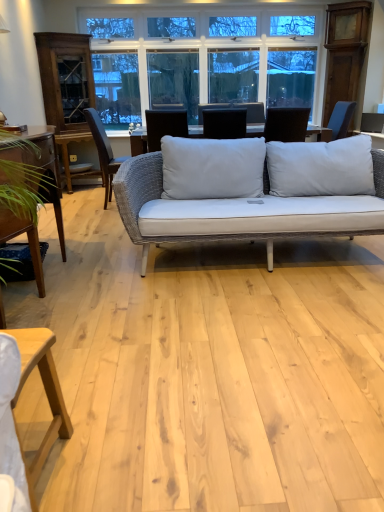
Question: Which direction should I rotate to face matte black laptop at center, which appears as the 1th chair when viewed from the front, — up or down?

Choices:
 (A) up
 (B) down

Answer: (A)

Question: From a real-world perspective, is light wood table at lower left, the first table ordered from the bottom, below matte black laptop at center, which appears as the 1th chair when viewed from the front?

Choices:
 (A) yes
 (B) no

Answer: (A)

Question: Would you say matte black laptop at center, which appears as the 1th chair when viewed from the front, is part of light wood table at lower left, placed as the second table when sorted from back to front,'s contents?

Choices:
 (A) yes
 (B) no

Answer: (B)

Question: Is light wood table at lower left, acting as the second table starting from the left, at the left side of matte black laptop at center, which is counted as the first chair, starting from the right?

Choices:
 (A) yes
 (B) no

Answer: (A)

Question: From a real-world perspective, does light wood table at lower left, which appears as the second table when viewed from the top, stand above matte black laptop at center, which appears as the 1th chair when viewed from the front?

Choices:
 (A) no
 (B) yes

Answer: (A)

Question: Is light wood table at lower left, which is the 1th table in front-to-back order, outside matte black laptop at center, which is counted as the first chair, starting from the right?

Choices:
 (A) no
 (B) yes

Answer: (B)

Question: Is light wood table at lower left, the first table ordered from the bottom, positioned with its back to matte black laptop at center, which is counted as the first chair, starting from the right?

Choices:
 (A) yes
 (B) no

Answer: (B)

Question: Is white glass window at upper center wider than light wood table at lower left, acting as the second table starting from the left?

Choices:
 (A) no
 (B) yes

Answer: (A)

Question: Is white glass window at upper center aimed at light wood table at lower left, placed as the second table when sorted from back to front?

Choices:
 (A) no
 (B) yes

Answer: (B)

Question: Does white glass window at upper center appear on the left side of light wood table at lower left, acting as the second table starting from the left?

Choices:
 (A) yes
 (B) no

Answer: (B)

Question: Is light wood table at lower left, which appears as the second table when viewed from the top, located within white glass window at upper center?

Choices:
 (A) yes
 (B) no

Answer: (B)

Question: From the image's perspective, is white glass window at upper center above light wood table at lower left, placed as the second table when sorted from back to front?

Choices:
 (A) yes
 (B) no

Answer: (A)

Question: From a real-world perspective, is white glass window at upper center positioned under light wood table at lower left, positioned as the 1th table in right-to-left order, based on gravity?

Choices:
 (A) yes
 (B) no

Answer: (B)

Question: From a real-world perspective, is wooden table at left, acting as the 1th table starting from the back, located beneath dark brown wood chair at left, arranged as the first chair when viewed from the back?

Choices:
 (A) yes
 (B) no

Answer: (A)